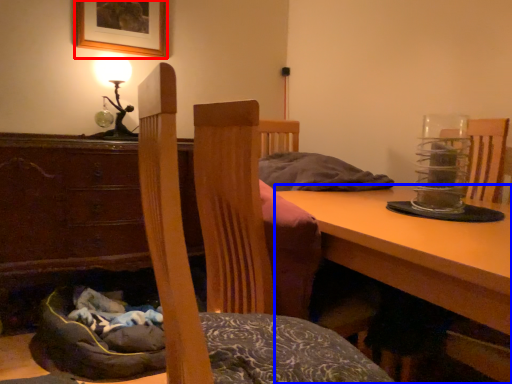
Question: Among these objects, which one is nearest to the camera, picture frame (highlighted by a red box) or table (highlighted by a blue box)?

Choices:
 (A) picture frame
 (B) table

Answer: (B)